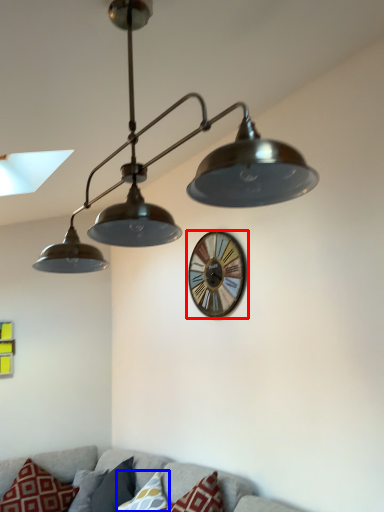
Question: Which of the following is the farthest to the observer, wall clock (highlighted by a red box) or pillow (highlighted by a blue box)?

Choices:
 (A) wall clock
 (B) pillow

Answer: (A)